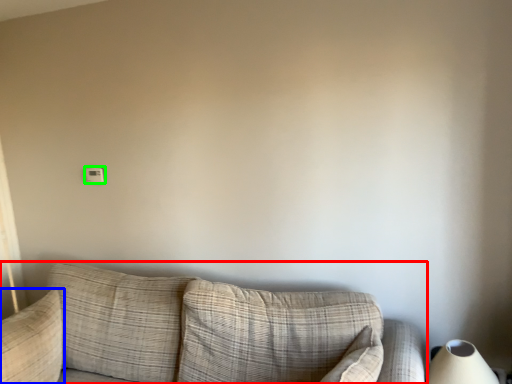
Question: Which object is positioned farthest from studio couch (highlighted by a red box)? Select from pillow (highlighted by a blue box) and light switch (highlighted by a green box).

Choices:
 (A) pillow
 (B) light switch

Answer: (B)